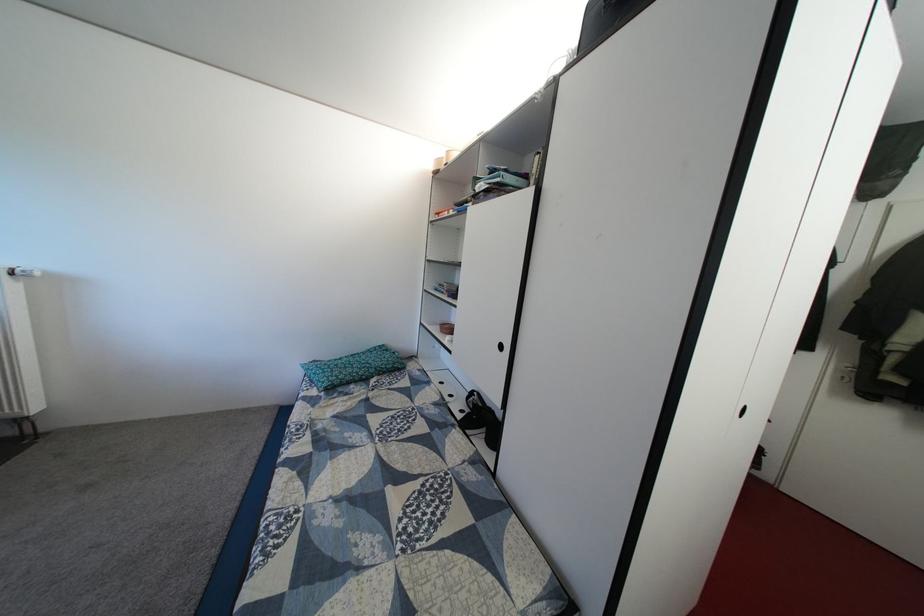
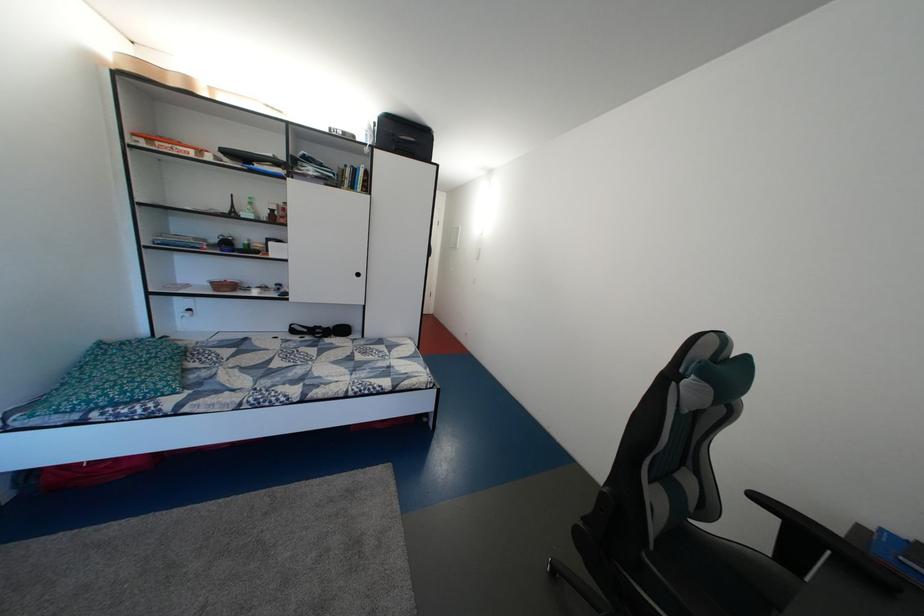
The point at (x=326, y=528) is marked in the first image. Where is the corresponding point in the second image?

(373, 382)